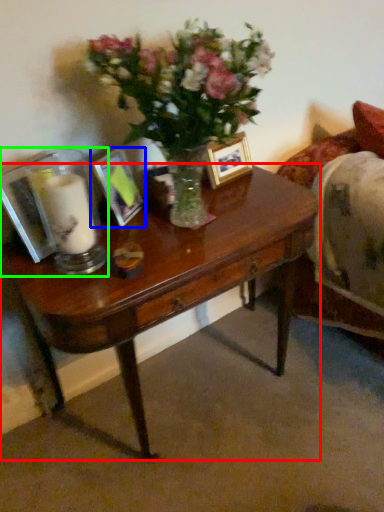
Question: Based on their relative distances, which object is farther from desk (highlighted by a red box)? Choose from picture frame (highlighted by a blue box) and tableware (highlighted by a green box).

Choices:
 (A) picture frame
 (B) tableware

Answer: (A)